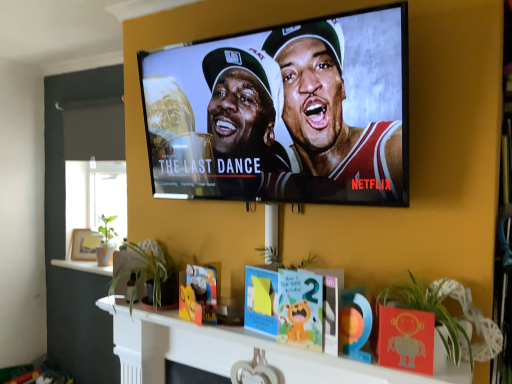
Measure the distance between green leafy plant at lower right, marked as the second plant in a back-to-front arrangement, and camera.

green leafy plant at lower right, marked as the second plant in a back-to-front arrangement, is 3.51 feet away from camera.

The width and height of the screenshot is (512, 384). What do you see at coordinates (234, 352) in the screenshot? I see `wooden heart-shaped ornament at center` at bounding box center [234, 352].

You are a GUI agent. You are given a task and a screenshot of the screen. Output one action in this format:
    pyautogui.click(x=<x>, y=<y>)
    Task: Click on the green leafy plant at lower center, which appears as the 2th plant when viewed from the front
    Image resolution: width=512 pixels, height=384 pixels.
    Given the screenshot: What is the action you would take?
    pyautogui.click(x=145, y=270)

Locate an element on the screen. This screenshot has width=512, height=384. matte black tv at upper center is located at coordinates (283, 112).

Describe the element at coordinates (283, 112) in the screenshot. I see `matte black tv at upper center` at that location.

Identify the location of green leafy plant at lower right, positioned as the second plant in left-to-right order. The image size is (512, 384). (418, 327).

Is green leafy plant at lower right, the first plant positioned from the front, wider than matte black tv at upper center?

Yes, green leafy plant at lower right, the first plant positioned from the front, is wider than matte black tv at upper center.

Does point (399, 350) come closer to viewer compared to point (388, 56)?

Yes.

Where is `television that appears behind the green leafy plant at lower right, marked as the second plant in a back-to-front arrangement`? Image resolution: width=512 pixels, height=384 pixels. television that appears behind the green leafy plant at lower right, marked as the second plant in a back-to-front arrangement is located at coordinates (283, 112).

Is green leafy plant at lower right, the first plant positioned from the front, oriented towards matte black tv at upper center?

No, green leafy plant at lower right, the first plant positioned from the front, is not turned towards matte black tv at upper center.

Is green leafy plant at lower right, placed as the 1th plant when sorted from right to left, positioned with its back to wooden photo frame at left?

No, wooden photo frame at left is not at the back of green leafy plant at lower right, placed as the 1th plant when sorted from right to left.

Could you measure the distance between green leafy plant at lower right, positioned as the second plant in left-to-right order, and wooden photo frame at left?

green leafy plant at lower right, positioned as the second plant in left-to-right order, is 7.54 feet from wooden photo frame at left.

Is point (426, 304) closer or farther from the camera than point (82, 255)?

Point (426, 304) is closer to the camera than point (82, 255).

Could green leafy plant at lower right, placed as the 1th plant when sorted from right to left, be considered to be inside wooden photo frame at left?

No, wooden photo frame at left does not contain green leafy plant at lower right, placed as the 1th plant when sorted from right to left.

This screenshot has width=512, height=384. I want to click on the 2nd plant in front when counting from the wooden photo frame at left, so click(418, 327).

Between wooden photo frame at left and green leafy plant at lower right, positioned as the second plant in left-to-right order, which one has more height?

wooden photo frame at left.

From a real-world perspective, relative to green leafy plant at lower right, placed as the 1th plant when sorted from right to left, is wooden photo frame at left vertically above or below?

Clearly, from a real-world perspective, wooden photo frame at left is below green leafy plant at lower right, placed as the 1th plant when sorted from right to left.

Looking at the image, does wooden photo frame at left seem bigger or smaller compared to matte black tv at upper center?

Considering their sizes, wooden photo frame at left takes up less space than matte black tv at upper center.

From the image's perspective, is wooden photo frame at left on matte black tv at upper center?

Actually, wooden photo frame at left appears below matte black tv at upper center in the image.

Between point (82, 232) and point (246, 54), which one is positioned in front?

The point (246, 54) is closer to the camera.

Which is more to the left, wooden photo frame at left or matte black tv at upper center?

wooden photo frame at left is more to the left.

Is wooden photo frame at left positioned beyond the bounds of wooden heart-shaped ornament at center?

Yes.

Does wooden photo frame at left have a larger size compared to wooden heart-shaped ornament at center?

No, wooden photo frame at left is not bigger than wooden heart-shaped ornament at center.

Is point (72, 256) in front of point (293, 372)?

That is False.

How many degrees apart are the facing directions of matte black tv at upper center and wooden heart-shaped ornament at center?

matte black tv at upper center and wooden heart-shaped ornament at center are facing 0.000272 degrees away from each other.

From the image's perspective, which is below, matte black tv at upper center or wooden heart-shaped ornament at center?

From the image's view, wooden heart-shaped ornament at center is below.

From the picture: Between matte black tv at upper center and wooden heart-shaped ornament at center, which one has larger size?

With larger size is matte black tv at upper center.

Could you tell me if wooden heart-shaped ornament at center is turned towards green leafy plant at lower center, which is the 2th plant from right to left?

No, wooden heart-shaped ornament at center is not facing towards green leafy plant at lower center, which is the 2th plant from right to left.

Is point (160, 368) more distant than point (154, 278)?

Yes, it is.

From a real-world perspective, which is physically above, wooden heart-shaped ornament at center or green leafy plant at lower center, which appears as the 2th plant when viewed from the front?

green leafy plant at lower center, which appears as the 2th plant when viewed from the front.

Considering their positions, is wooden heart-shaped ornament at center located in front of or behind green leafy plant at lower center, which ranks as the first plant in left-to-right order?

Clearly, wooden heart-shaped ornament at center is in front of green leafy plant at lower center, which ranks as the first plant in left-to-right order.

The width and height of the screenshot is (512, 384). Identify the location of television that is on the left side of green leafy plant at lower right, the first plant positioned from the front. (283, 112).

The height and width of the screenshot is (384, 512). What are the coordinates of `plant that is the 2nd object located in front of the wooden photo frame at left` in the screenshot? It's located at [x=418, y=327].

Estimate the real-world distances between objects in this image. Which object is closer to matte black tv at upper center, green leafy plant at lower right, marked as the second plant in a back-to-front arrangement, or green leafy plant at lower center, which appears as the 2th plant when viewed from the front?

green leafy plant at lower right, marked as the second plant in a back-to-front arrangement, is positioned closer to the anchor matte black tv at upper center.

Which object lies further to the anchor point green leafy plant at lower right, positioned as the second plant in left-to-right order, wooden heart-shaped ornament at center or wooden photo frame at left?

wooden photo frame at left lies further to green leafy plant at lower right, positioned as the second plant in left-to-right order, than the other object.

Looking at this image, considering their positions, is green leafy plant at lower right, the first plant positioned from the front, positioned further to wooden heart-shaped ornament at center than matte black tv at upper center?

matte black tv at upper center.

Estimate the real-world distances between objects in this image. Which object is further from wooden heart-shaped ornament at center, wooden photo frame at left or matte black tv at upper center?

Result: wooden photo frame at left lies further to wooden heart-shaped ornament at center than the other object.

Which object lies nearer to the anchor point wooden heart-shaped ornament at center, matte black tv at upper center or wooden photo frame at left?

Based on the image, matte black tv at upper center appears to be nearer to wooden heart-shaped ornament at center.

From the image, which object appears to be nearer to wooden photo frame at left, green leafy plant at lower right, positioned as the second plant in left-to-right order, or matte black tv at upper center?

Based on the image, matte black tv at upper center appears to be nearer to wooden photo frame at left.

Looking at the image, which one is located closer to green leafy plant at lower right, placed as the 1th plant when sorted from right to left, matte black tv at upper center or wooden heart-shaped ornament at center?

wooden heart-shaped ornament at center is closer to green leafy plant at lower right, placed as the 1th plant when sorted from right to left.

When comparing their distances from wooden photo frame at left, does matte black tv at upper center or green leafy plant at lower center, which ranks as the first plant in left-to-right order, seem closer?

green leafy plant at lower center, which ranks as the first plant in left-to-right order, is positioned closer to the anchor wooden photo frame at left.

What are the coordinates of `plant between wooden heart-shaped ornament at center and wooden photo frame at left from front to back` in the screenshot? It's located at (145, 270).

Find the location of a particular element. This screenshot has height=384, width=512. shelf positioned between matte black tv at upper center and wooden photo frame at left from near to far is located at coordinates (234, 352).

Identify the location of shelf between green leafy plant at lower center, which ranks as the first plant in left-to-right order, and green leafy plant at lower right, placed as the 1th plant when sorted from right to left. The width and height of the screenshot is (512, 384). (234, 352).

The width and height of the screenshot is (512, 384). Identify the location of plant between green leafy plant at lower right, the first plant positioned from the front, and wooden photo frame at left from front to back. (145, 270).